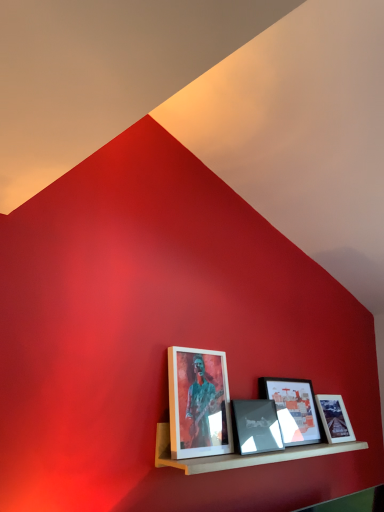
Question: From the image's perspective, is matte black picture frame at center, the second picture frame from the right, above or below matte black picture frame at center, the third picture frame in the right-to-left sequence?

Choices:
 (A) below
 (B) above

Answer: (A)

Question: Based on their sizes in the image, would you say matte black picture frame at center, which is counted as the 3th picture frame, starting from the left, is bigger or smaller than matte black picture frame at center, the 2th picture frame viewed from the left?

Choices:
 (A) small
 (B) big

Answer: (B)

Question: Based on their relative distances, which object is nearer to the matte black picture frame at center, the second picture frame from the right?

Choices:
 (A) wooden shelf at lower center
 (B) matte white picture frame at center, which is the fourth picture frame in right-to-left order
 (C) matte glass picture frame at center, placed as the fourth picture frame when sorted from left to right
 (D) matte black picture frame at center, the 2th picture frame viewed from the left

Answer: (D)

Question: Which object is the closest to the matte glass picture frame at center, which is the first picture frame from right to left?

Choices:
 (A) matte white picture frame at center, which appears as the 1th picture frame when viewed from the left
 (B) wooden shelf at lower center
 (C) matte black picture frame at center, the second picture frame from the right
 (D) matte black picture frame at center, the 2th picture frame viewed from the left

Answer: (C)